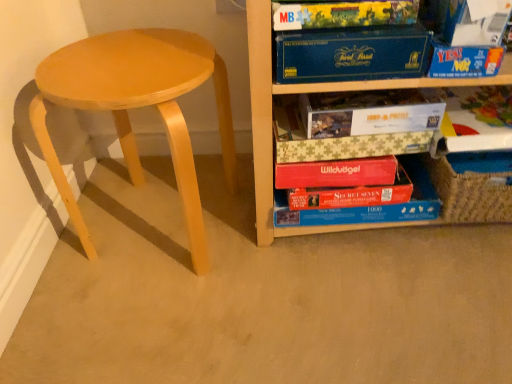
Question: Is white paper at upper right, which is the first paperback book in top-to-bottom order, turned away from yellow cardboard puzzle box at upper center, which ranks as the 2th paperback book in top-to-bottom order?

Choices:
 (A) no
 (B) yes

Answer: (A)

Question: From the image's perspective, would you say white paper at upper right, arranged as the fourth paperback book when ordered from the bottom, is positioned over yellow cardboard puzzle box at upper center, which ranks as the 2th paperback book in top-to-bottom order?

Choices:
 (A) yes
 (B) no

Answer: (A)

Question: Can you confirm if white paper at upper right, which is the first paperback book in top-to-bottom order, is thinner than yellow cardboard puzzle box at upper center, which ranks as the 2th paperback book in top-to-bottom order?

Choices:
 (A) yes
 (B) no

Answer: (B)

Question: Can you confirm if white paper at upper right, arranged as the fourth paperback book when ordered from the bottom, is positioned to the left of yellow cardboard puzzle box at upper center, which is the 3th paperback book in bottom-to-top order?

Choices:
 (A) yes
 (B) no

Answer: (B)

Question: Does white paper at upper right, which is the first paperback book in top-to-bottom order, have a smaller size compared to yellow cardboard puzzle box at upper center, which is the 3th paperback book in bottom-to-top order?

Choices:
 (A) yes
 (B) no

Answer: (B)

Question: Based on their sizes in the image, would you say blue cardboard box at upper right, arranged as the 3th paperback book when viewed from the top, is bigger or smaller than white cardboard puzzle box at center, arranged as the 1th paperback book when ordered from the bottom?

Choices:
 (A) big
 (B) small

Answer: (B)

Question: In terms of height, does blue cardboard box at upper right, arranged as the 3th paperback book when viewed from the top, look taller or shorter compared to white cardboard puzzle box at center, the fourth paperback book in the top-to-bottom sequence?

Choices:
 (A) tall
 (B) short

Answer: (A)

Question: Considering the positions of blue cardboard box at upper right, which ranks as the second paperback book in bottom-to-top order, and white cardboard puzzle box at center, arranged as the 1th paperback book when ordered from the bottom, in the image, is blue cardboard box at upper right, which ranks as the second paperback book in bottom-to-top order, wider or thinner than white cardboard puzzle box at center, arranged as the 1th paperback book when ordered from the bottom,?

Choices:
 (A) thin
 (B) wide

Answer: (A)

Question: From the image's perspective, is blue cardboard box at upper right, arranged as the 3th paperback book when viewed from the top, positioned above or below white cardboard puzzle box at center, the fourth paperback book in the top-to-bottom sequence?

Choices:
 (A) below
 (B) above

Answer: (B)

Question: Relative to wooden puzzle box at right, is white cardboard puzzle box at center, arranged as the 1th paperback book when ordered from the bottom, in front or behind?

Choices:
 (A) behind
 (B) front

Answer: (A)

Question: In terms of width, does white cardboard puzzle box at center, the fourth paperback book in the top-to-bottom sequence, look wider or thinner when compared to wooden puzzle box at right?

Choices:
 (A) thin
 (B) wide

Answer: (A)

Question: Considering the positions of white cardboard puzzle box at center, the fourth paperback book in the top-to-bottom sequence, and wooden puzzle box at right in the image, is white cardboard puzzle box at center, the fourth paperback book in the top-to-bottom sequence, taller or shorter than wooden puzzle box at right?

Choices:
 (A) short
 (B) tall

Answer: (A)

Question: From a real-world perspective, is white cardboard puzzle box at center, the fourth paperback book in the top-to-bottom sequence, positioned above or below wooden puzzle box at right?

Choices:
 (A) above
 (B) below

Answer: (A)

Question: Relative to yellow cardboard puzzle box at upper center, which ranks as the 2th paperback book in top-to-bottom order, is light wood stool at left in front or behind?

Choices:
 (A) front
 (B) behind

Answer: (A)

Question: Is light wood stool at left wider or thinner than yellow cardboard puzzle box at upper center, which ranks as the 2th paperback book in top-to-bottom order?

Choices:
 (A) thin
 (B) wide

Answer: (B)